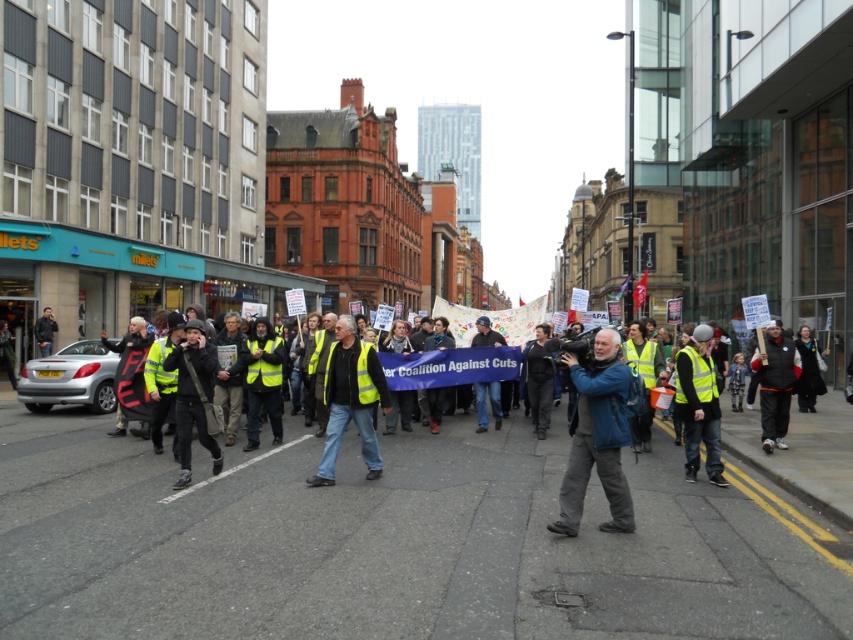
Does blue fabric camera at center have a greater width compared to dark gray fleece jacket at right?

In fact, blue fabric camera at center might be narrower than dark gray fleece jacket at right.

Is blue fabric camera at center shorter than dark gray fleece jacket at right?

Yes.

Between point (572, 435) and point (762, 371), which one is positioned behind?

Positioned behind is point (572, 435).

Where is `blue fabric camera at center`? blue fabric camera at center is located at coordinates point(596,436).

Does yellow reflective vest at center have a greater height compared to dark gray fleece jacket at right?

No, yellow reflective vest at center is not taller than dark gray fleece jacket at right.

Who is more distant from viewer, (368, 410) or (778, 387)?

Positioned behind is point (778, 387).

Does point (357, 408) come in front of point (791, 381)?

That is True.

Identify the location of yellow reflective vest at center. (351, 400).

Consider the image. Is blue fabric camera at center taller than yellow reflective vest at center?

No, blue fabric camera at center is not taller than yellow reflective vest at center.

Find the location of a particular element. The height and width of the screenshot is (640, 853). blue fabric camera at center is located at coordinates (596, 436).